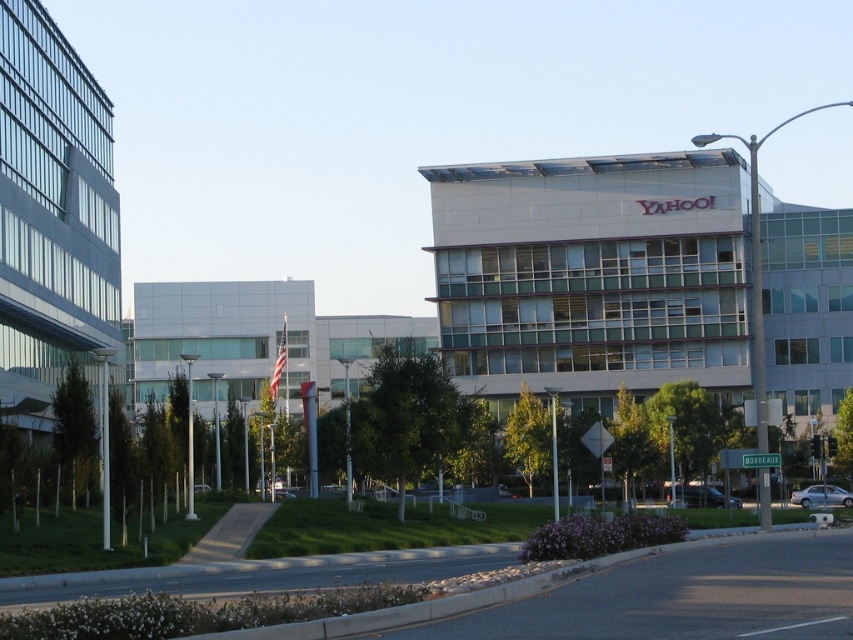
Between dark gray metallic van at center and silver metallic sedan at lower right, which one appears on the left side from the viewer's perspective?

From the viewer's perspective, dark gray metallic van at center appears more on the left side.

I want to click on dark gray metallic van at center, so click(x=704, y=497).

This screenshot has width=853, height=640. I want to click on dark gray metallic van at center, so click(x=704, y=497).